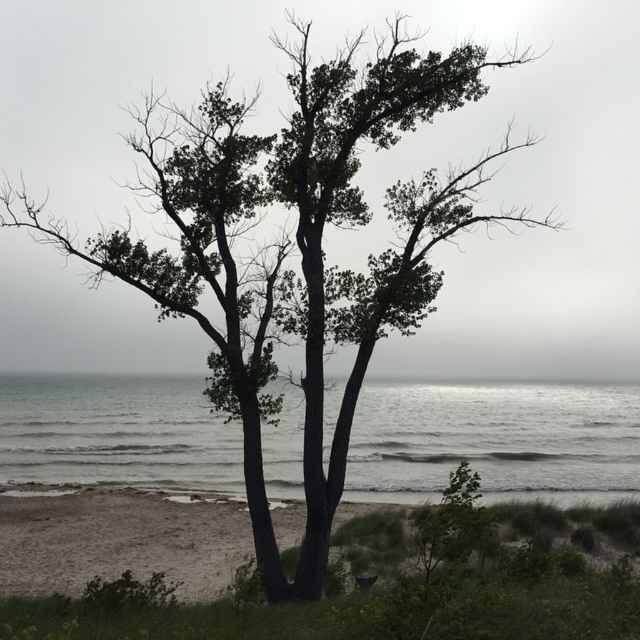
Is point (608, 445) more distant than point (582, 493)?

Yes, it is behind point (582, 493).

Who is more forward, (454, 456) or (177, 572)?

Positioned in front is point (177, 572).

Where is `gray water at center`? This screenshot has height=640, width=640. gray water at center is located at coordinates (496, 440).

Identify the location of gray water at center. (496, 440).